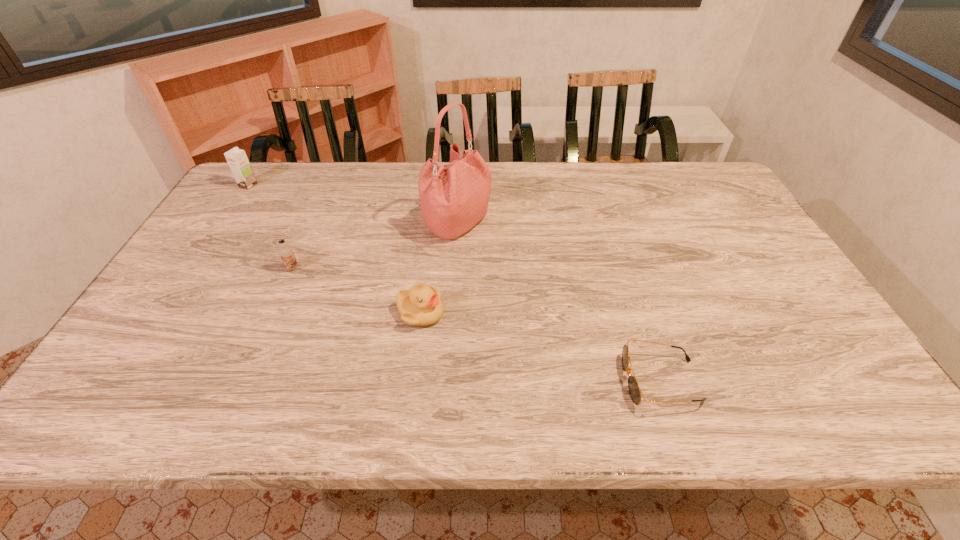
Identify the location of free space between the shortest object and the fourth farthest object. (540, 347).

Find the location of a particular element. This screenshot has width=960, height=540. blank region between the leftmost object and the nearest object is located at coordinates (454, 283).

Identify the location of vacant space that's between the right chocolate milk and the farther chocolate milk. The image size is (960, 540). (271, 227).

You are a GUI agent. You are given a task and a screenshot of the screen. Output one action in this format:
    pyautogui.click(x=<x>, y=<y>)
    Task: Click on the vacant space in between the fourth nearest object and the duckling
    Image resolution: width=960 pixels, height=540 pixels.
    Given the screenshot: What is the action you would take?
    pyautogui.click(x=439, y=268)

Where is `free spot between the fourth nearest object and the shortest object`? free spot between the fourth nearest object and the shortest object is located at coordinates (559, 302).

You are a GUI agent. You are given a task and a screenshot of the screen. Output one action in this format:
    pyautogui.click(x=<x>, y=<y>)
    Task: Click on the unoccupied position between the tallest object and the duckling
    The width and height of the screenshot is (960, 540).
    Given the screenshot: What is the action you would take?
    pyautogui.click(x=439, y=268)

Select which object is the closest to the fourth shortest object. Please provide its 2D coordinates. Your answer should be formatted as a tuple, i.e. [(x, y)], where the tuple contains the x and y coordinates of a point satisfying the conditions above.

[(286, 252)]

Locate which object is the closest to the farther chocolate milk. Please provide its 2D coordinates. Your answer should be formatted as a tuple, i.e. [(x, y)], where the tuple contains the x and y coordinates of a point satisfying the conditions above.

[(286, 252)]